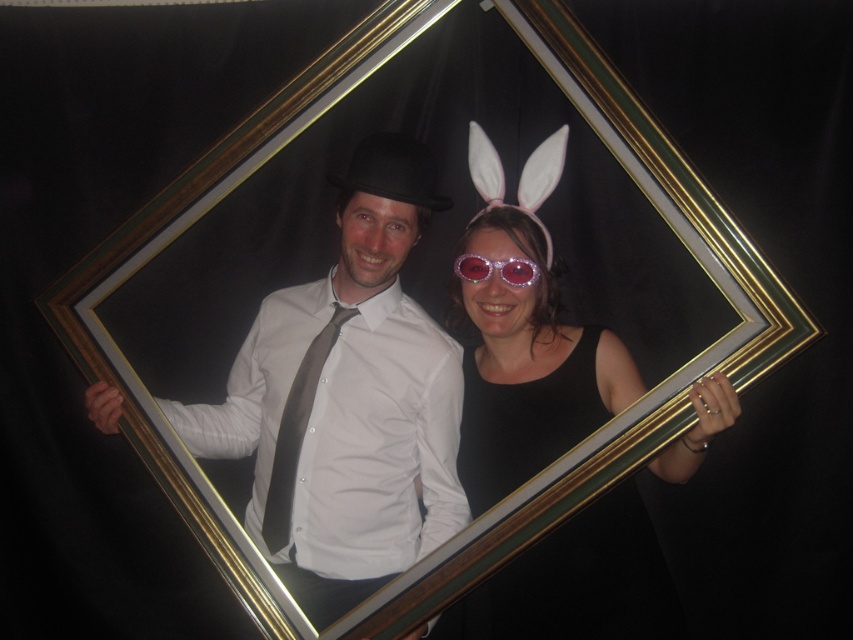
Between gray satin tie at center and sparkly pink goggles at center, which one appears on the left side from the viewer's perspective?

gray satin tie at center is more to the left.

Is gray satin tie at center positioned in front of sparkly pink goggles at center?

No, gray satin tie at center is behind sparkly pink goggles at center.

The width and height of the screenshot is (853, 640). What do you see at coordinates (296, 432) in the screenshot?
I see `gray satin tie at center` at bounding box center [296, 432].

Locate an element on the screen. The height and width of the screenshot is (640, 853). gray satin tie at center is located at coordinates (296, 432).

Who is positioned more to the right, sparkly pink sunglasses at center or gray satin tie at center?

sparkly pink sunglasses at center is more to the right.

Does sparkly pink sunglasses at center appear over gray satin tie at center?

No.

Locate an element on the screen. This screenshot has width=853, height=640. sparkly pink sunglasses at center is located at coordinates (526, 339).

Locate an element on the screen. The height and width of the screenshot is (640, 853). matte black bowler hat at center is located at coordinates (346, 401).

Who is more distant from viewer, (370,248) or (469,253)?

Positioned behind is point (469,253).

This screenshot has height=640, width=853. I want to click on matte black bowler hat at center, so click(x=346, y=401).